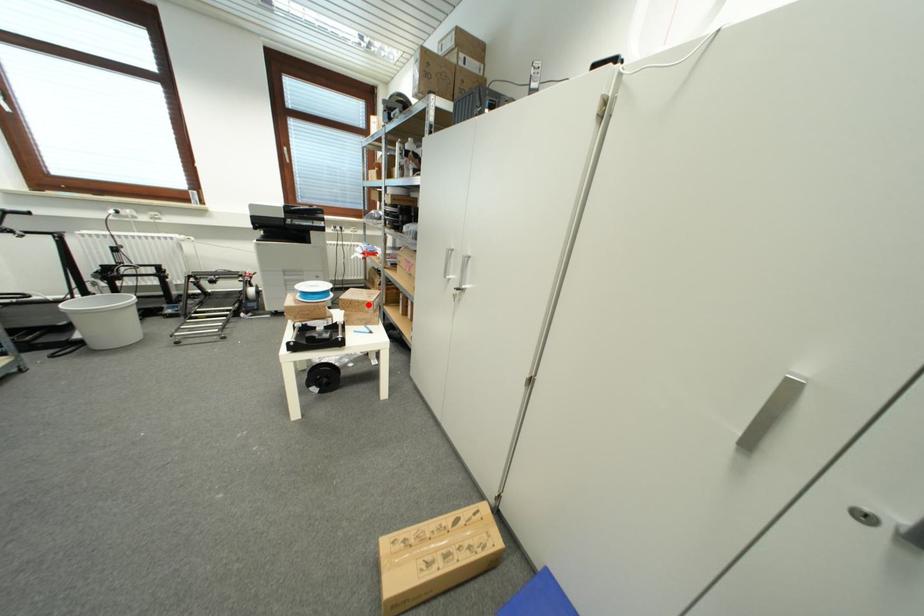
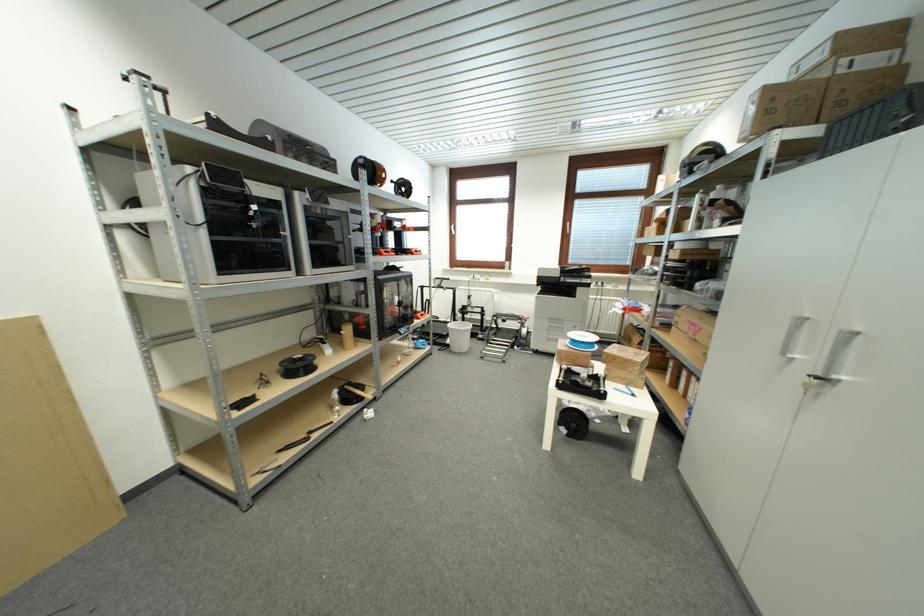
Question: I am providing you with two images of the same scene from different viewpoints. Given a red point in image1, look at the same physical point in image2. Is it:

Choices:
 (A) Closer to the viewpoint
 (B) Farther from the viewpoint

Answer: (B)